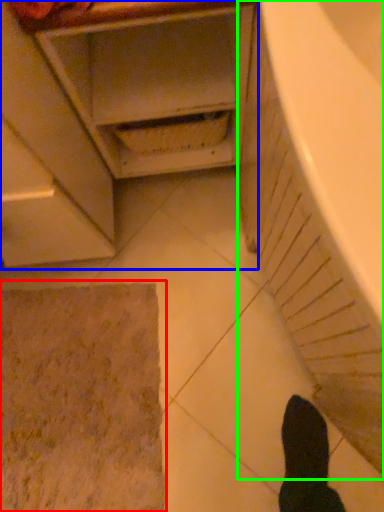
Question: Based on their relative distances, which object is nearer to bath mat (highlighted by a red box)? Choose from cabinetry (highlighted by a blue box) and bath (highlighted by a green box).

Choices:
 (A) cabinetry
 (B) bath

Answer: (A)